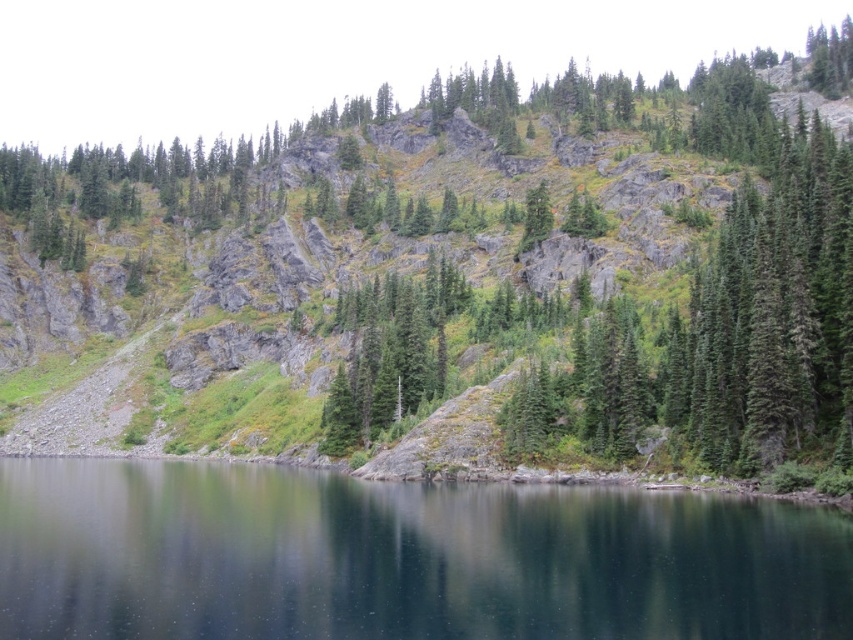
Does green grassy hillside at center lie in front of dark blue water at center?

That is False.

Is point (692, 372) positioned in front of point (624, 504)?

No, it is not.

Locate an element on the screen. The height and width of the screenshot is (640, 853). green grassy hillside at center is located at coordinates (456, 276).